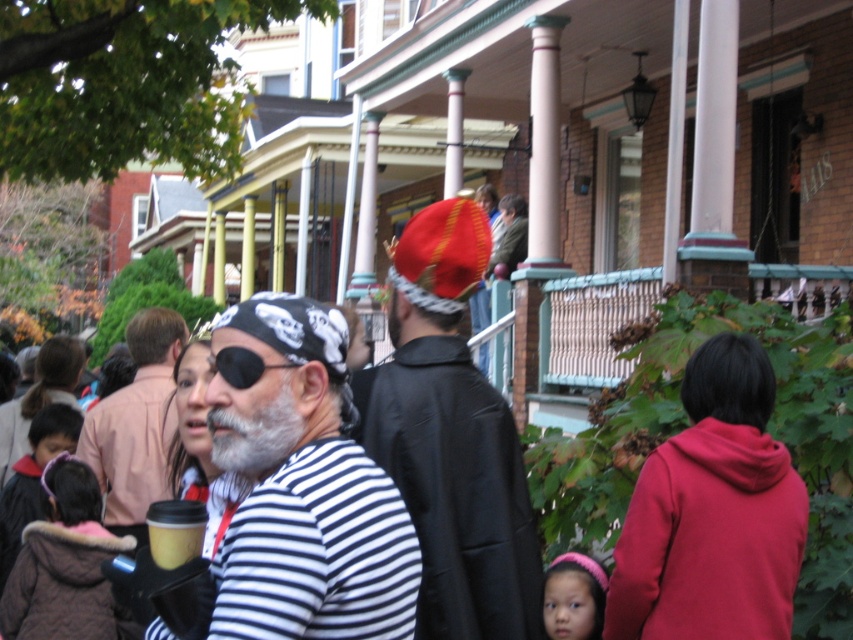
Does velvet black coat at lower left appear on the right side of pink fuzzy headband at lower right?

Incorrect, velvet black coat at lower left is not on the right side of pink fuzzy headband at lower right.

Can you confirm if velvet black coat at lower left is positioned above pink fuzzy headband at lower right?

Yes, velvet black coat at lower left is above pink fuzzy headband at lower right.

Between point (6, 500) and point (593, 582), which one is positioned behind?

Point (6, 500)

This screenshot has width=853, height=640. In order to click on velvet black coat at lower left in this screenshot , I will do `click(33, 477)`.

Is point (465, 621) closer to camera compared to point (735, 436)?

That is True.

Who is taller, shiny red fabric hat at center or matte red hoodie at lower right?

Standing taller between the two is shiny red fabric hat at center.

Is point (494, 465) behind point (704, 355)?

No, it is not.

The height and width of the screenshot is (640, 853). What are the coordinates of `shiny red fabric hat at center` in the screenshot? It's located at (451, 438).

Is shiny red fabric hat at center closer to the viewer compared to brown fuzzy coat at lower left?

Yes, shiny red fabric hat at center is in front of brown fuzzy coat at lower left.

Is shiny red fabric hat at center above brown fuzzy coat at lower left?

Yes, shiny red fabric hat at center is above brown fuzzy coat at lower left.

Is point (471, 512) closer to camera compared to point (47, 547)?

Yes.

Locate an element on the screen. Image resolution: width=853 pixels, height=640 pixels. shiny red fabric hat at center is located at coordinates (451, 438).